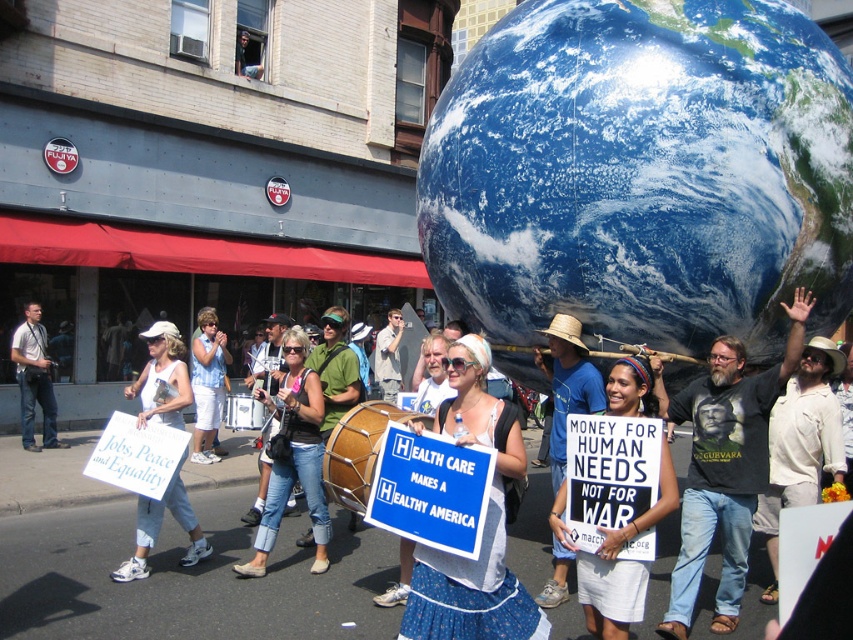
You are a photographer standing at the edge of the protest. You want to take a photo of the white cotton shorts at lower center and the white fabric sign at lower left. Which object should you focus on first if you want to capture both in a single frame without moving the camera?

The white cotton shorts at lower center is much taller than the white fabric sign at lower left, so you should focus on the white cotton shorts at lower center first to ensure it is in clear view before adjusting the frame to include the shorter white fabric sign at lower left.

You are a photographer standing at the scene. You want to take a closeup shot of the blue glossy earth at upper center. The camera you are using has a minimum focusing distance of 2 meters. Can you take the photo without moving closer?

The blue glossy earth at upper center is 5.87 meters from viewer. Since the minimum focusing distance is 2 meters, the photographer can take the photo without moving closer because the distance is sufficient.